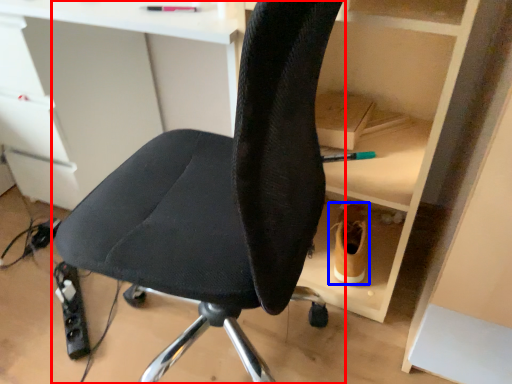
Question: Which of the following is the closest to the observer, chair (highlighted by a red box) or footwear (highlighted by a blue box)?

Choices:
 (A) chair
 (B) footwear

Answer: (A)